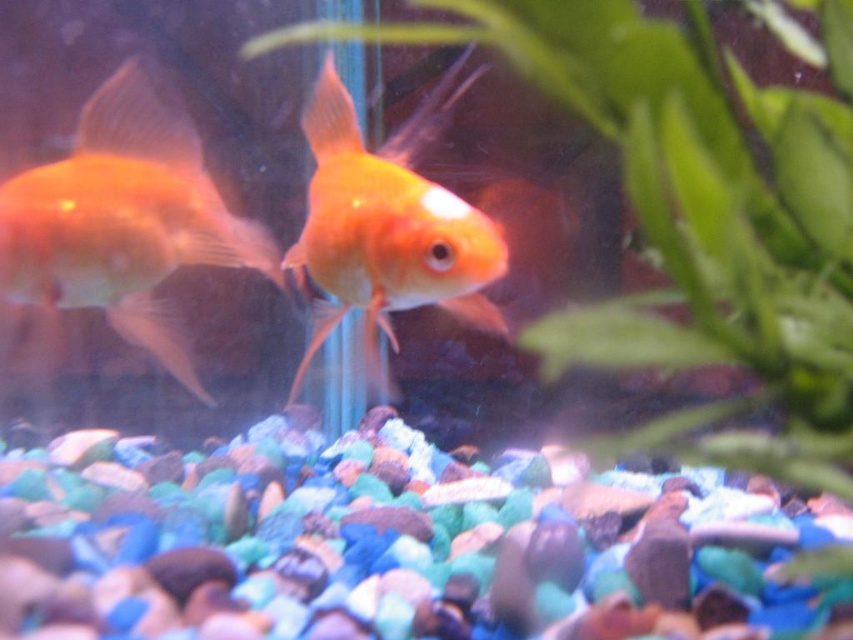
What is located at the point with coordinates (695, 218) in the aquarium scene?

The point with coordinates (695, 218) indicates a green leafy plant at center in the aquarium scene.

You are an aquatic plant specialist examining the aquarium. You notice the green leafy plant at center and the matte orange goldfish at left. Based on their positions, which object occupies more horizontal space in the image?

The green leafy plant at center might be wider than the matte orange goldfish at left, so it likely occupies more horizontal space in the image.